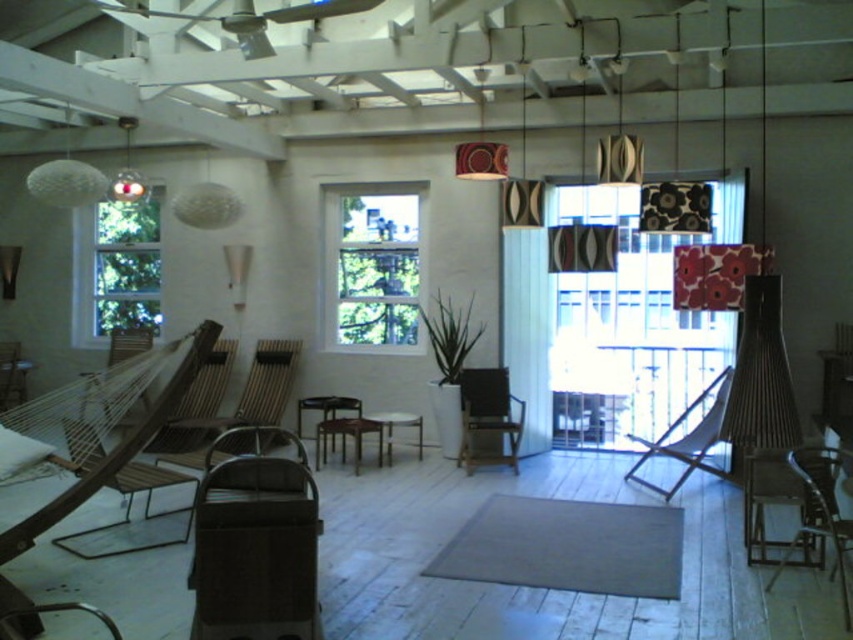
Question: Where is wooden slatted chair at center located in relation to wooden armchair at left in the image?

Choices:
 (A) left
 (B) right

Answer: (B)

Question: Which point is closer to the camera taking this photo?

Choices:
 (A) (689, 385)
 (B) (473, 419)

Answer: (B)

Question: Which of the following is the farthest from the observer?

Choices:
 (A) wooden slatted chair at center
 (B) wooden armchair at lower right
 (C) wooden slatted chair at left
 (D) clear glass window at left

Answer: (D)

Question: Is clear glass window at center to the left of clear glass window at left from the viewer's perspective?

Choices:
 (A) yes
 (B) no

Answer: (B)

Question: Is clear glass window at center below wooden armchair at lower right?

Choices:
 (A) yes
 (B) no

Answer: (B)

Question: Which object is closer to the camera taking this photo?

Choices:
 (A) clear glass window at left
 (B) wooden armchair at left
 (C) white woven hammock at left
 (D) wooden slatted chair at left

Answer: (D)